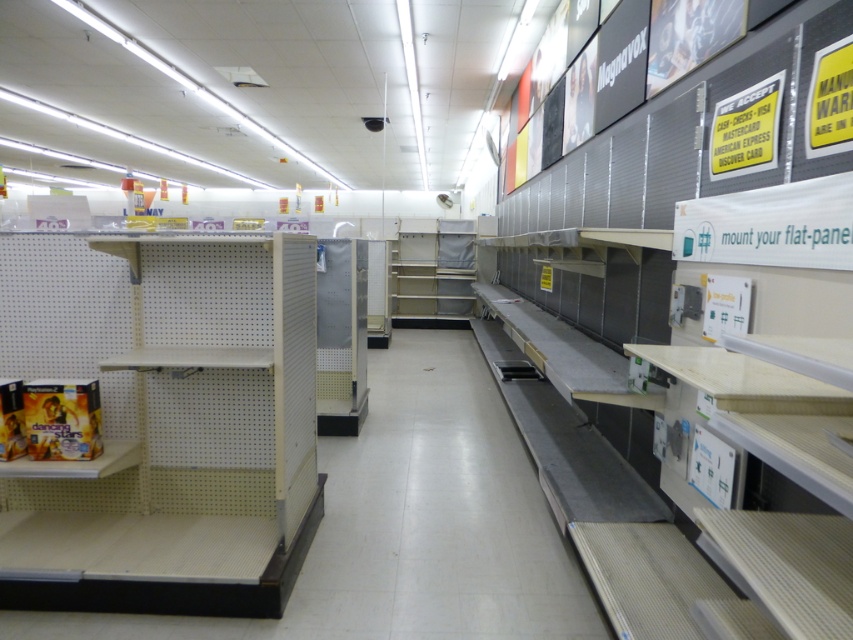
How much distance is there between white pegboard shelf at left and metallic silver shelf at center?

white pegboard shelf at left is 7.89 meters from metallic silver shelf at center.

Is white pegboard shelf at left taller than metallic silver shelf at center?

No.

The width and height of the screenshot is (853, 640). Find the location of `white pegboard shelf at left`. white pegboard shelf at left is located at coordinates (167, 420).

This screenshot has height=640, width=853. Find the location of `white pegboard shelf at left`. white pegboard shelf at left is located at coordinates [x=167, y=420].

Does white pegboard shelf at left appear under white matte shelf at left?

No, white pegboard shelf at left is not below white matte shelf at left.

Find the location of a particular element. This screenshot has height=640, width=853. white pegboard shelf at left is located at coordinates (167, 420).

Who is more distant from viewer, [73,600] or [341,540]?

The point [341,540] is behind.

Identify the location of white pegboard shelf at left. Image resolution: width=853 pixels, height=640 pixels. (167, 420).

Which of these two, white matte shelf at left or metallic silver shelf at center, stands shorter?

white matte shelf at left

Between white matte shelf at left and metallic silver shelf at center, which one is positioned higher?

metallic silver shelf at center is higher up.

Is point (437, 444) closer to viewer compared to point (410, 307)?

Yes, it is in front of point (410, 307).

Find the location of a particular element. This screenshot has height=640, width=853. white matte shelf at left is located at coordinates (408, 525).